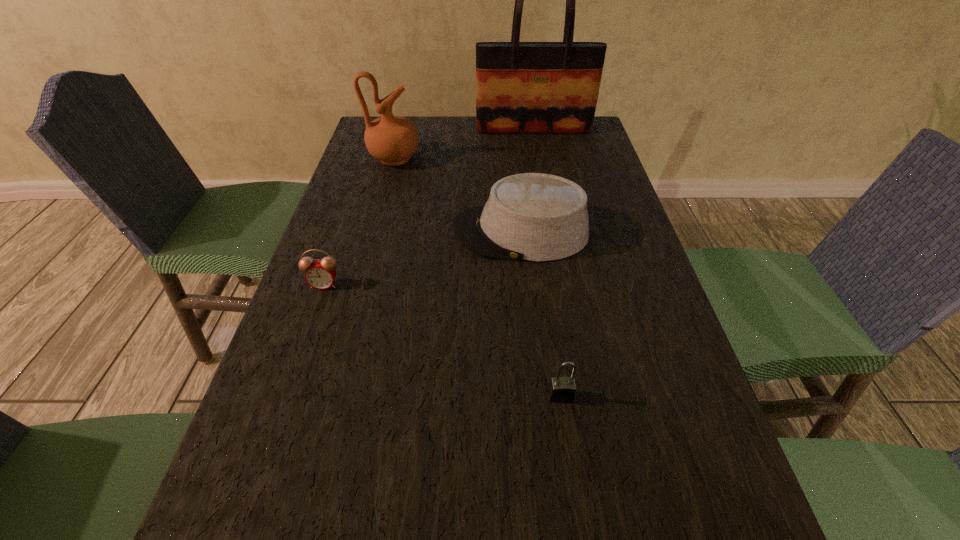
Identify the location of free space located 0.200m on the front-facing side of the third farthest object. coord(372,232).

Locate an element on the screen. This screenshot has width=960, height=540. vacant space located on the front-facing side of the third farthest object is located at coordinates (420, 232).

You are a GUI agent. You are given a task and a screenshot of the screen. Output one action in this format:
    pyautogui.click(x=<x>, y=<y>)
    Task: Click on the free location located 0.180m on the shackle of the padlock
    The width and height of the screenshot is (960, 540).
    Given the screenshot: What is the action you would take?
    pyautogui.click(x=578, y=516)

The height and width of the screenshot is (540, 960). I want to click on vacant area situated 0.200m on the clock face of the fourth farthest object, so click(x=295, y=369).

What are the coordinates of `shopping bag located at the far edge` in the screenshot? It's located at (521, 87).

Find the location of `pottery that is positioned at the far edge`. pottery that is positioned at the far edge is located at coordinates [391, 139].

This screenshot has height=540, width=960. Identify the location of pottery at the left edge. (391, 139).

Where is `alarm clock located at the left edge`? This screenshot has height=540, width=960. alarm clock located at the left edge is located at coordinates (320, 274).

This screenshot has width=960, height=540. Find the location of `shopping bag that is at the right edge`. shopping bag that is at the right edge is located at coordinates (521, 87).

At what (x,y) coordinates should I click in order to perform the action: click on hat present at the right edge. Please return your answer as a coordinate pair (x, y). Looking at the image, I should click on (537, 217).